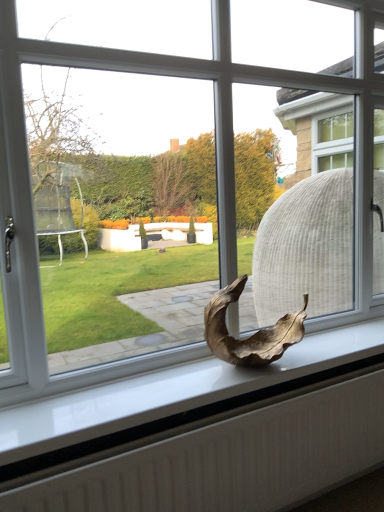
Image resolution: width=384 pixels, height=512 pixels. Identify the location of free space above white textured radiator at lower center (from a real-world perspective). (272, 395).